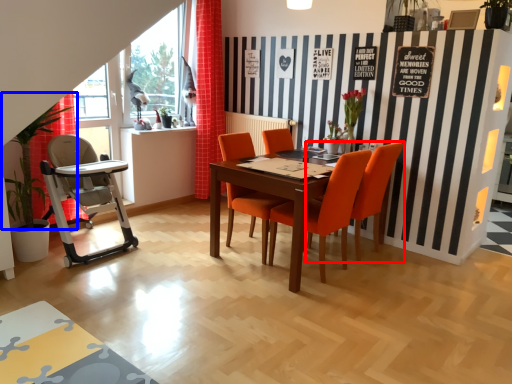
Question: Among these objects, which one is nearest to the camera, chair (highlighted by a red box) or plant (highlighted by a blue box)?

Choices:
 (A) chair
 (B) plant

Answer: (B)